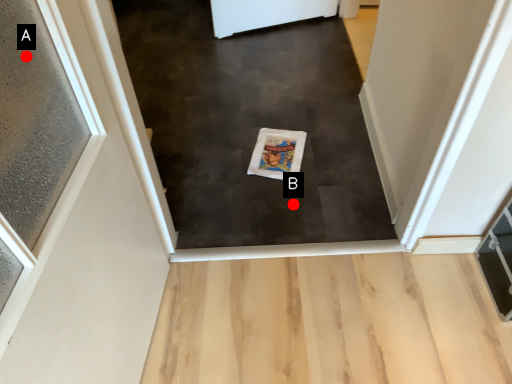
Question: Two points are circled on the image, labeled by A and B beside each circle. Which point is farther to the camera?

Choices:
 (A) A is further
 (B) B is further

Answer: (B)